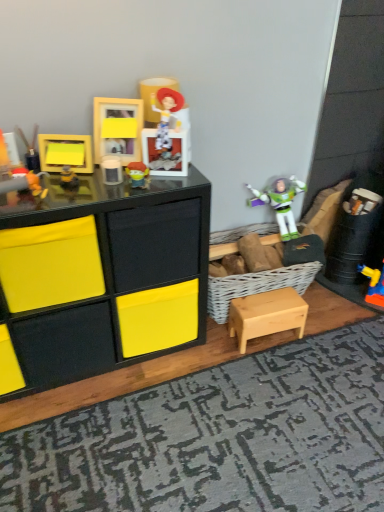
Locate an element on the screen. vacant space to the right of matte black toy at left, placed as the fifth toy when sorted from right to left is located at coordinates (69, 192).